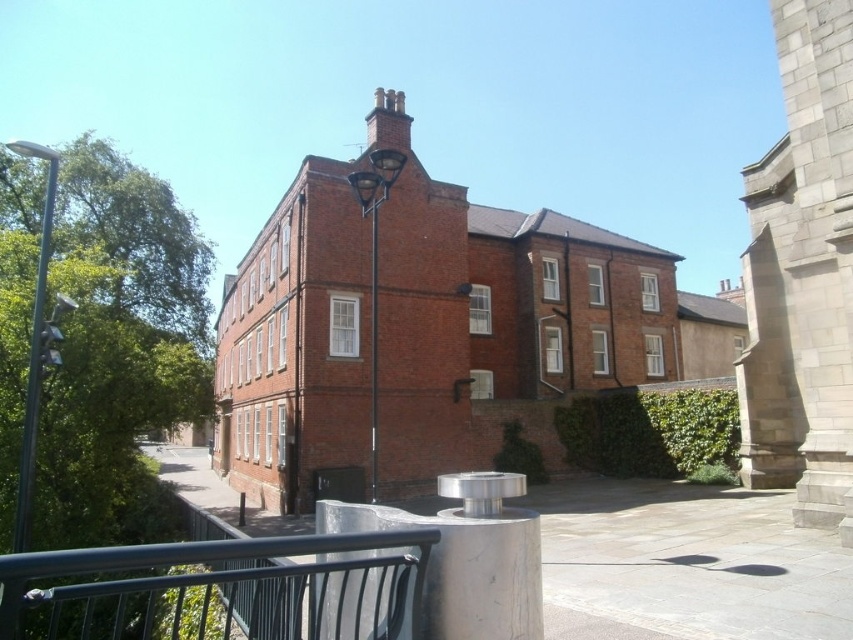
Does green leafy hedge at center come behind metallic pole at left?

Yes, green leafy hedge at center is further from the viewer.

Image resolution: width=853 pixels, height=640 pixels. Describe the element at coordinates (648, 432) in the screenshot. I see `green leafy hedge at center` at that location.

Which is in front, point (670, 460) or point (36, 276)?

Positioned in front is point (36, 276).

You are a GUI agent. You are given a task and a screenshot of the screen. Output one action in this format:
    pyautogui.click(x=<x>, y=<y>)
    Task: Click on the green leafy hedge at center
    The image size is (853, 640).
    Given the screenshot: What is the action you would take?
    pyautogui.click(x=648, y=432)

Between point (374, 564) and point (596, 422), which one is positioned behind?

The point (596, 422) is behind.

Is black metal railing at lower left to the left of green leafy hedge at center from the viewer's perspective?

Yes, black metal railing at lower left is to the left of green leafy hedge at center.

Find the location of a particular element. black metal railing at lower left is located at coordinates (241, 584).

Which is more to the left, metallic pole at left or metallic silver streetlamp at center?

metallic pole at left is more to the left.

Who is more distant from viewer, (27,483) or (376,166)?

The point (376,166) is more distant.

This screenshot has width=853, height=640. What do you see at coordinates (33, 348) in the screenshot?
I see `metallic pole at left` at bounding box center [33, 348].

The image size is (853, 640). Identify the location of metallic pole at left. (33, 348).